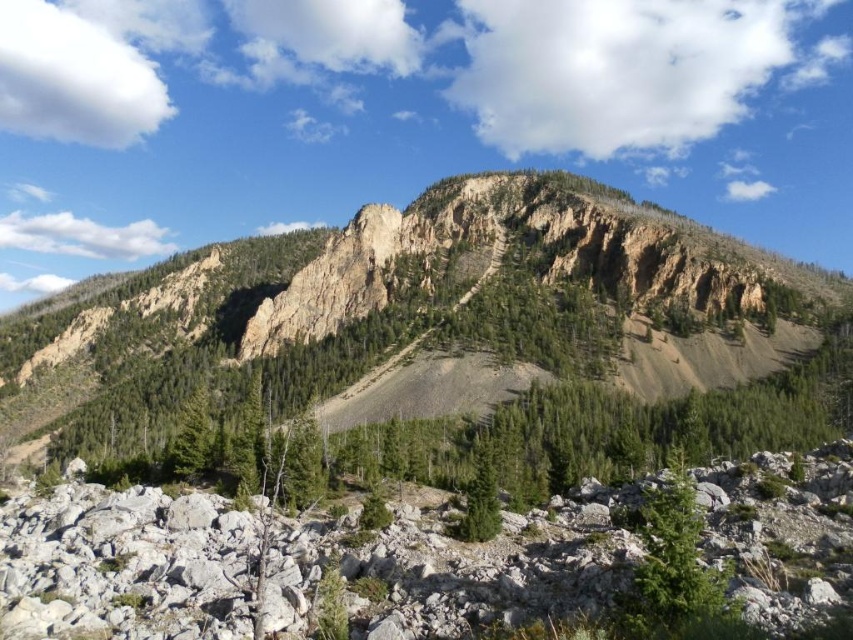
What do you see at coordinates (384, 305) in the screenshot? This screenshot has width=853, height=640. I see `brown rocky mountain at center` at bounding box center [384, 305].

From the picture: Can you confirm if brown rocky mountain at center is thinner than gray rock at lower center?

No, brown rocky mountain at center is not thinner than gray rock at lower center.

What do you see at coordinates (384, 305) in the screenshot?
I see `brown rocky mountain at center` at bounding box center [384, 305].

Find the location of a particular element. This screenshot has width=853, height=640. brown rocky mountain at center is located at coordinates (384, 305).

In the scene shown: Can you confirm if brown rocky mountain at center is positioned above green matte tree at lower right?

Correct, brown rocky mountain at center is located above green matte tree at lower right.

Who is more distant from viewer, (80, 284) or (650, 532)?

The point (80, 284) is more distant.

What do you see at coordinates (384, 305) in the screenshot?
I see `brown rocky mountain at center` at bounding box center [384, 305].

Locate an element on the screen. Image resolution: width=853 pixels, height=640 pixels. brown rocky mountain at center is located at coordinates (384, 305).

Who is higher up, gray rock at lower center or green matte tree at center?

gray rock at lower center

Image resolution: width=853 pixels, height=640 pixels. I want to click on gray rock at lower center, so click(454, 570).